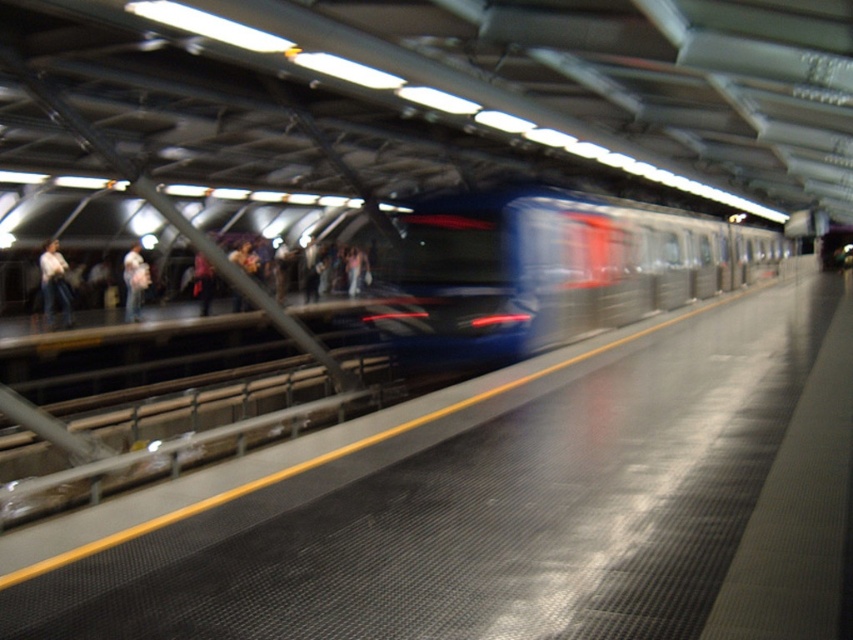
Question: Can you confirm if jeans at left is positioned to the right of light blue jeans at center?

Choices:
 (A) yes
 (B) no

Answer: (A)

Question: Where is jeans at left located in relation to light blue jeans at center in the image?

Choices:
 (A) left
 (B) right

Answer: (B)

Question: Which of the following is the farthest from the observer?

Choices:
 (A) white shirt at left
 (B) metallic blue train at center
 (C) light blue jeans at center

Answer: (C)

Question: Does jeans at left have a greater width compared to white shirt at left?

Choices:
 (A) no
 (B) yes

Answer: (B)

Question: Which object is positioned closest to the metallic blue train at center?

Choices:
 (A) light blue jeans at center
 (B) jeans at left
 (C) white shirt at left

Answer: (B)

Question: Which of the following is the closest to the observer?

Choices:
 (A) (59, 257)
 (B) (155, 300)
 (C) (514, 264)

Answer: (C)